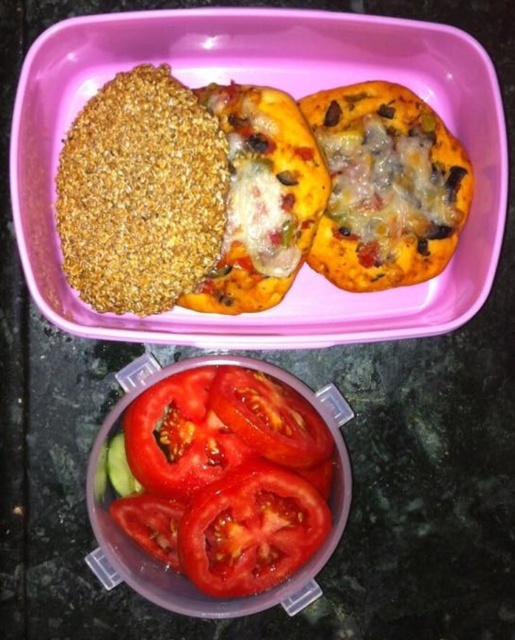
You are standing in a kitchen and want to place a 1.5 meter long cutting board between the point at coordinates point (146, 406) and the viewer. Will the cutting board fit?

The distance between point (146, 406) and the viewer is 1.26 meters. Since the cutting board is 1.5 meters long, it will not fit as it is longer than the available space.

You are a food delivery person who needs to place a hot pizza box on the counter without touching any tomatoes. The pizza box is 30 centimeters wide. Is there enough space between the sliced red tomato at center and the sliced red tomato at lower center to fit the pizza box?

The distance between the sliced red tomato at center and the sliced red tomato at lower center is 20.70 centimeters. Since the pizza box is 30 centimeters wide, it cannot fit in the available space between them.

You are a food delivery person who needs to place a protective cover over the red matte tomato at center and the sliced red tomato at center. Which one should you cover first to avoid blocking the other?

The red matte tomato at center is further to the viewer than sliced red tomato at center, so you should cover the red matte tomato at center first to avoid blocking the sliced red tomato at center.